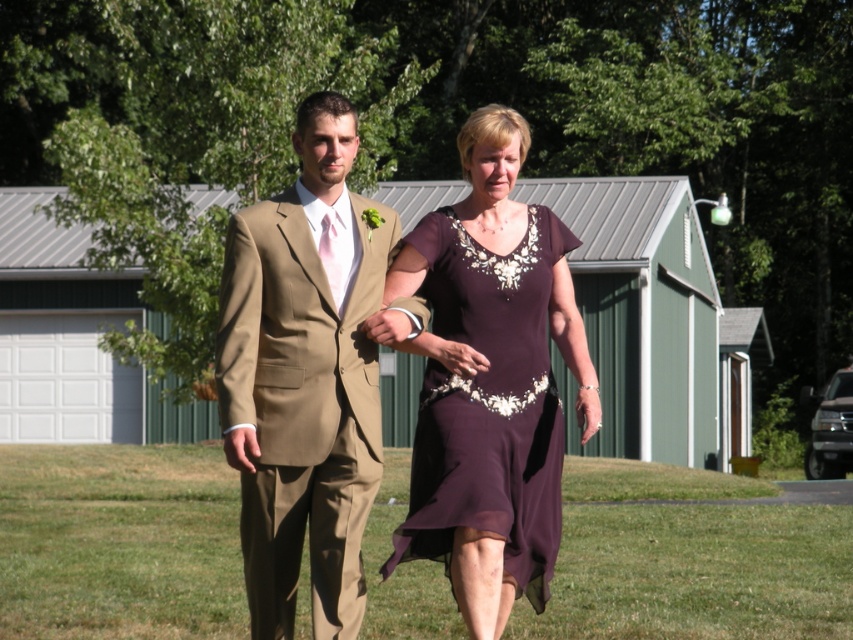
Consider the image. Is matte khaki suit at center to the right of dark purple chiffon dress at center from the viewer's perspective?

Incorrect, matte khaki suit at center is not on the right side of dark purple chiffon dress at center.

Can you confirm if matte khaki suit at center is taller than dark purple chiffon dress at center?

Correct, matte khaki suit at center is much taller as dark purple chiffon dress at center.

Describe the element at coordinates (306, 376) in the screenshot. The height and width of the screenshot is (640, 853). I see `matte khaki suit at center` at that location.

Find the location of a particular element. matte khaki suit at center is located at coordinates (306, 376).

Between dark purple chiffon dress at center and matte purple dress at center, which one is positioned lower?

dark purple chiffon dress at center

Between dark purple chiffon dress at center and matte purple dress at center, which one appears on the left side from the viewer's perspective?

matte purple dress at center is more to the left.

Find the location of a particular element. This screenshot has width=853, height=640. dark purple chiffon dress at center is located at coordinates (488, 403).

Does matte khaki suit at center appear on the right side of matte purple dress at center?

Incorrect, matte khaki suit at center is not on the right side of matte purple dress at center.

Based on the photo, is matte khaki suit at center shorter than matte purple dress at center?

No.

Identify the location of matte khaki suit at center. (306, 376).